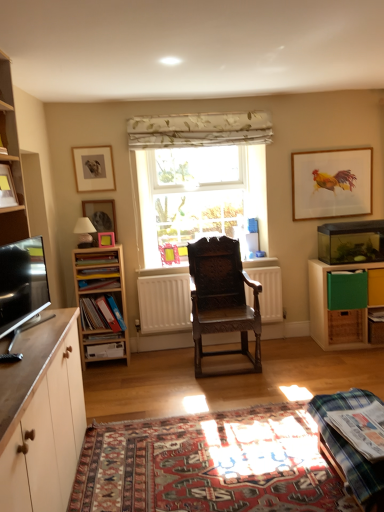
Question: From the image's perspective, is matte plastic book at center-left, arranged as the 4th book when ordered from the bottom, located beneath green wood cube at right, the first cabinetry from the right?

Choices:
 (A) no
 (B) yes

Answer: (A)

Question: Is matte plastic book at center-left, arranged as the 2th book when viewed from the top, outside green wood cube at right, the first cabinetry from the right?

Choices:
 (A) yes
 (B) no

Answer: (A)

Question: Is matte plastic book at center-left, the third book from the back, with green wood cube at right, the second cabinetry in the front-to-back sequence?

Choices:
 (A) no
 (B) yes

Answer: (A)

Question: Considering the relative positions of matte plastic book at center-left, the third book from the back, and green wood cube at right, the 1th cabinetry when ordered from back to front, in the image provided, is matte plastic book at center-left, the third book from the back, in front of green wood cube at right, the 1th cabinetry when ordered from back to front,?

Choices:
 (A) yes
 (B) no

Answer: (A)

Question: Is matte plastic book at center-left, the third book from the back, behind green wood cube at right, the 1th cabinetry when ordered from back to front?

Choices:
 (A) yes
 (B) no

Answer: (B)

Question: Is green wood cube at right, the 1th cabinetry when ordered from back to front, a part of matte plastic book at center-left, the third book from the back?

Choices:
 (A) no
 (B) yes

Answer: (A)

Question: Can you confirm if matte wooden picture frame at center, the 1th picture frame viewed from the front, is thinner than plaid fabric table at lower right?

Choices:
 (A) no
 (B) yes

Answer: (B)

Question: From the image's perspective, is matte wooden picture frame at center, the 1th picture frame viewed from the front, beneath plaid fabric table at lower right?

Choices:
 (A) yes
 (B) no

Answer: (B)

Question: Is matte wooden picture frame at center, the 1th picture frame viewed from the front, at the left side of plaid fabric table at lower right?

Choices:
 (A) yes
 (B) no

Answer: (A)

Question: Is matte wooden picture frame at center, which ranks as the 2th picture frame in right-to-left order, not close to plaid fabric table at lower right?

Choices:
 (A) no
 (B) yes

Answer: (B)

Question: Can you confirm if matte wooden picture frame at center, the 1th picture frame viewed from the front, is bigger than plaid fabric table at lower right?

Choices:
 (A) yes
 (B) no

Answer: (B)

Question: Is matte wooden picture frame at center, which ranks as the 2th picture frame in right-to-left order, in contact with plaid fabric table at lower right?

Choices:
 (A) yes
 (B) no

Answer: (B)

Question: Considering the relative positions of green plastic drawer at right, the 1th drawer when ordered from right to left, and plaid fabric table at lower right in the image provided, is green plastic drawer at right, the 1th drawer when ordered from right to left, behind plaid fabric table at lower right?

Choices:
 (A) yes
 (B) no

Answer: (A)